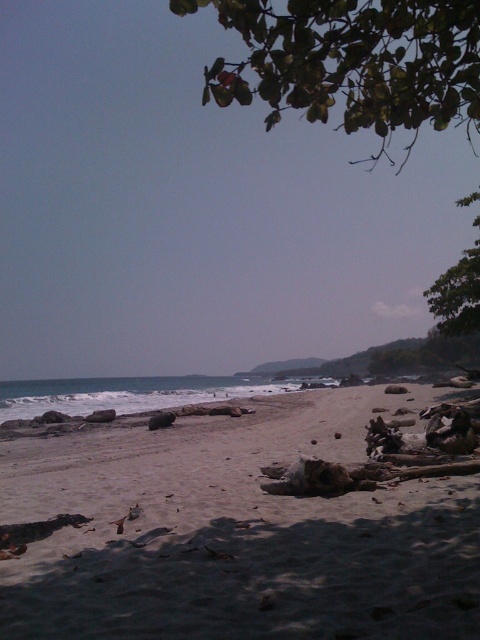
You are standing on the beach and want to place a 3.5 meter long boat on the white sandy beach at center. Is there enough space for the boat to be placed horizontally without overlapping the driftwood pieces?

The white sandy beach at center is 3.62 meters away from the viewer, but the question is about the length of the beach, not the distance. Since the boat is 3.5 meters long and the beach is at center, there should be enough space as the beach extends sufficiently in the foreground. However, the presence of driftwood pieces might require adjusting the placement to avoid overlap. The exact dimensions of the beach arenide not provided, so the answer is speculative. However, given the description mentions thedrf

In the scene shown: You are standing on the white sandy beach at center and want to walk towards the green leafy tree at upper right. Which direction should you head to get closer to the tree?

You should head towards the upper right direction to get closer to the green leafy tree at upper right since it is located in that direction and is further away from the viewer compared to the white sandy beach at center.

You are standing on the beach and looking at the green leafy branch at upper center and the blue water at lower left. Which object is nearer to you?

The green leafy branch at upper center is closer to the viewer than the blue water at lower left.